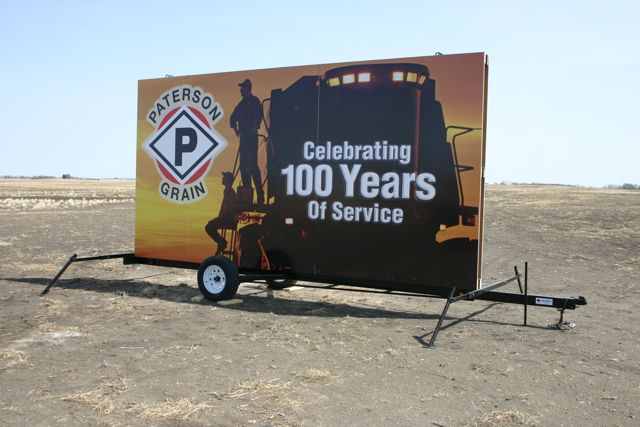
I want to click on poster, so click(173, 209).